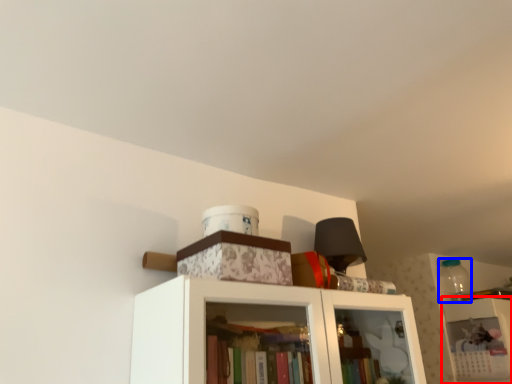
Question: Which of the following is the closest to the observer, shelf (highlighted by a red box) or bottle (highlighted by a blue box)?

Choices:
 (A) shelf
 (B) bottle

Answer: (A)